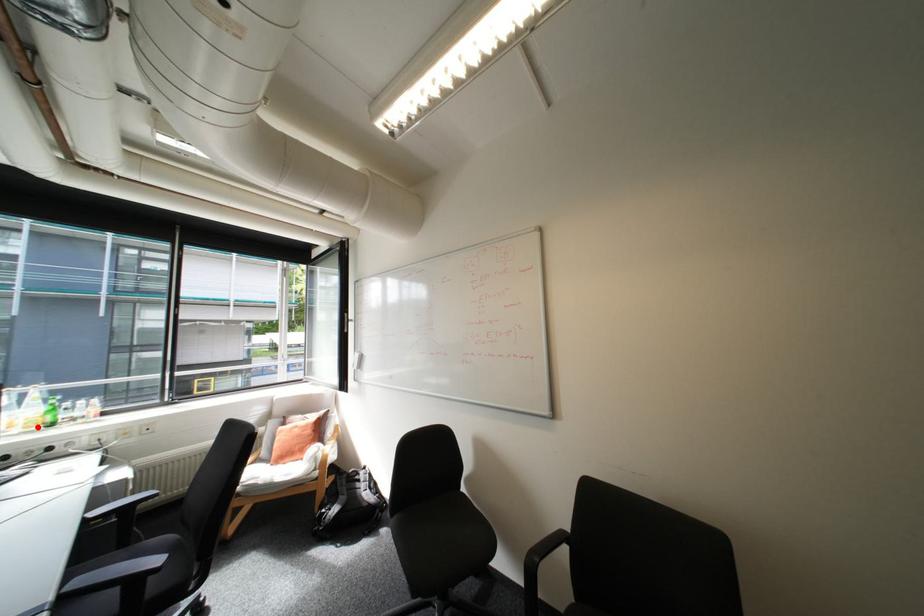
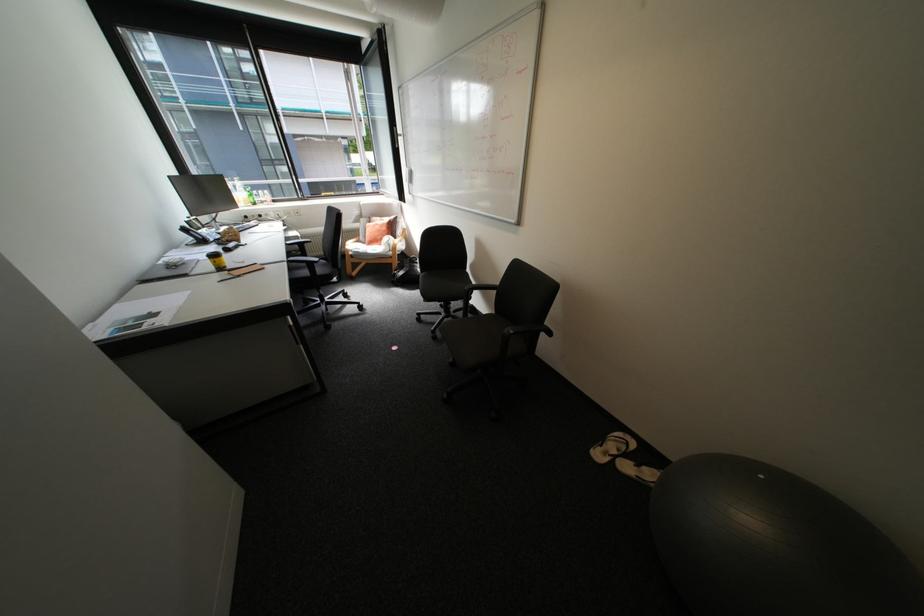
The point at the highlighted location is marked in the first image. Where is the corresponding point in the second image?

(256, 204)